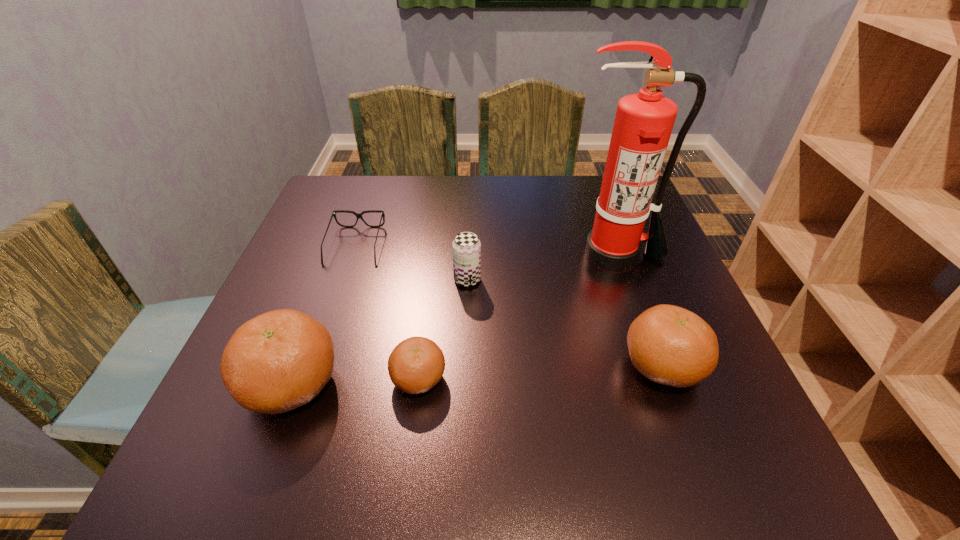
Locate an element on the screen. Image resolution: width=960 pixels, height=540 pixels. free point between the tallest object and the rightmost clementine is located at coordinates click(x=638, y=311).

This screenshot has width=960, height=540. Identify the location of empty space that is in between the tallest object and the shortest object. (486, 251).

Image resolution: width=960 pixels, height=540 pixels. What are the coordinates of `free space between the leftmost clementine and the spectacles` in the screenshot? It's located at (324, 315).

The height and width of the screenshot is (540, 960). In order to click on vacant area that lies between the tallest object and the rightmost clementine in this screenshot , I will do `click(638, 311)`.

Where is `the second closest object to the rightmost clementine`? the second closest object to the rightmost clementine is located at coordinates (466, 247).

Find the location of a particular element. The image size is (960, 540). the third closest object to the second clementine from left to right is located at coordinates (359, 215).

You are a GUI agent. You are given a task and a screenshot of the screen. Output one action in this format:
    pyautogui.click(x=<x>, y=<y>)
    Task: Click on the second closest clementine to the tallest object
    
    Given the screenshot: What is the action you would take?
    pyautogui.click(x=417, y=364)

Image resolution: width=960 pixels, height=540 pixels. Find the location of `the closest clementine to the beer can`. the closest clementine to the beer can is located at coordinates (417, 364).

The height and width of the screenshot is (540, 960). I want to click on vacant space that satisfies the following two spatial constraints: 1. at the nozzle of the rightmost clementine; 2. on the left side of the fire extinguisher, so click(x=655, y=367).

Identify the location of free space that satisfies the following two spatial constraints: 1. with the lenses facing outward on the rightmost clementine; 2. on the left side of the spectacles. The height and width of the screenshot is (540, 960). (315, 367).